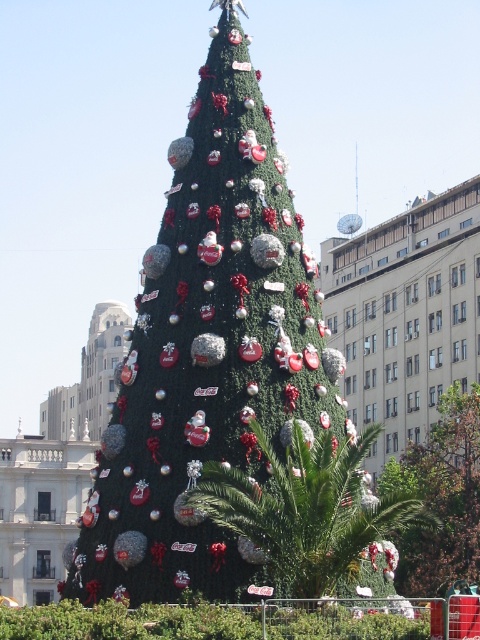
Question: Does green textured christmas tree at center lie in front of green leafy palm tree at center?

Choices:
 (A) no
 (B) yes

Answer: (A)

Question: Can you confirm if green leafy palm tree at center is bigger than green matte christmas tree at center?

Choices:
 (A) no
 (B) yes

Answer: (A)

Question: Which object is closer to the camera taking this photo?

Choices:
 (A) green leafy palm tree at center
 (B) green textured christmas tree at center
 (C) green matte christmas tree at center

Answer: (A)

Question: Which object appears closest to the camera in this image?

Choices:
 (A) green textured christmas tree at center
 (B) green leafy palm tree at center
 (C) green matte christmas tree at center

Answer: (B)

Question: Which object is closer to the camera taking this photo?

Choices:
 (A) green textured christmas tree at center
 (B) green leafy palm tree at center

Answer: (B)

Question: Does green leafy palm tree at center appear on the left side of green matte christmas tree at center?

Choices:
 (A) yes
 (B) no

Answer: (A)